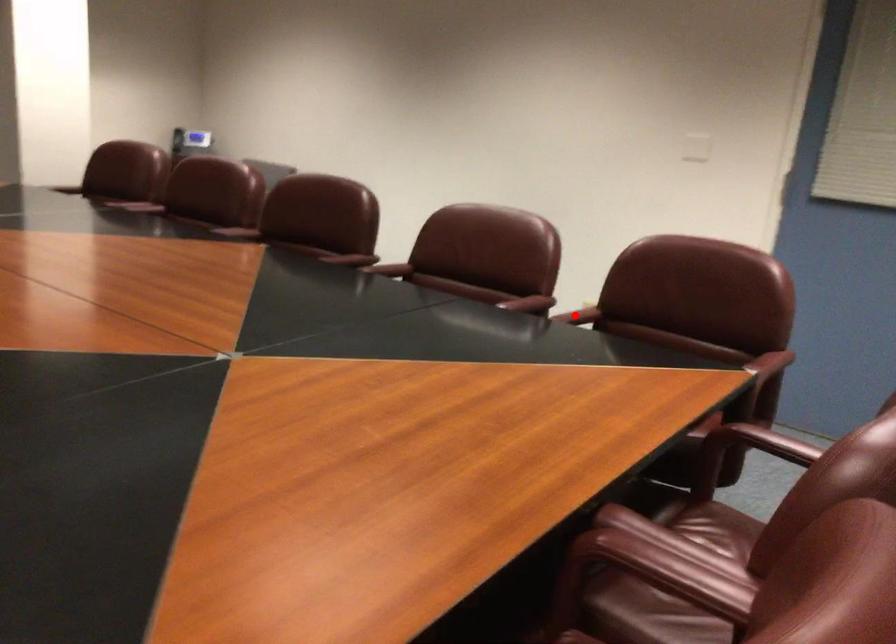
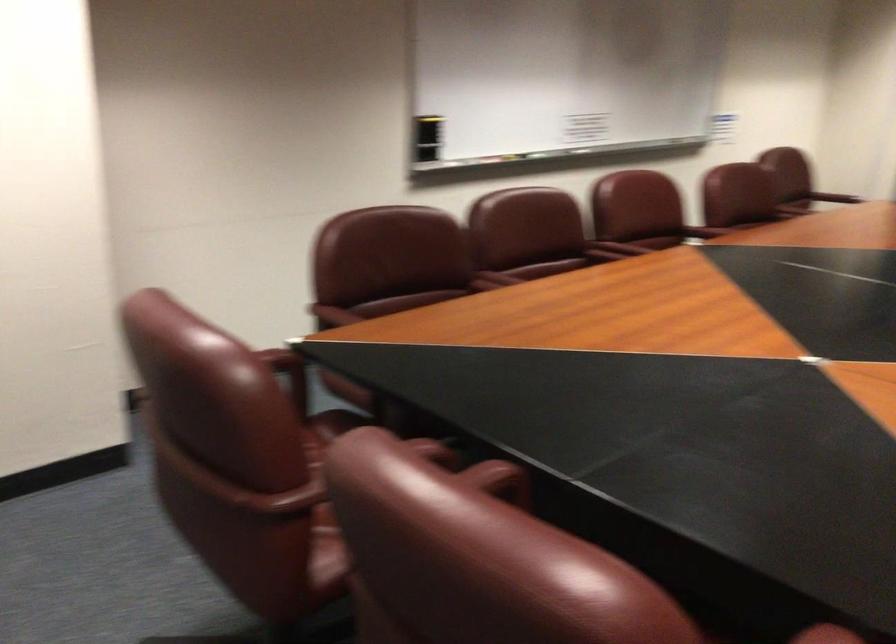
Question: A red point is marked in image1. In image2, is the corresponding 3D point closer to the camera or farther? Reply with the corresponding letter.

Choices:
 (A) The corresponding 3D point is closer.
 (B) The corresponding 3D point is farther.

Answer: (A)